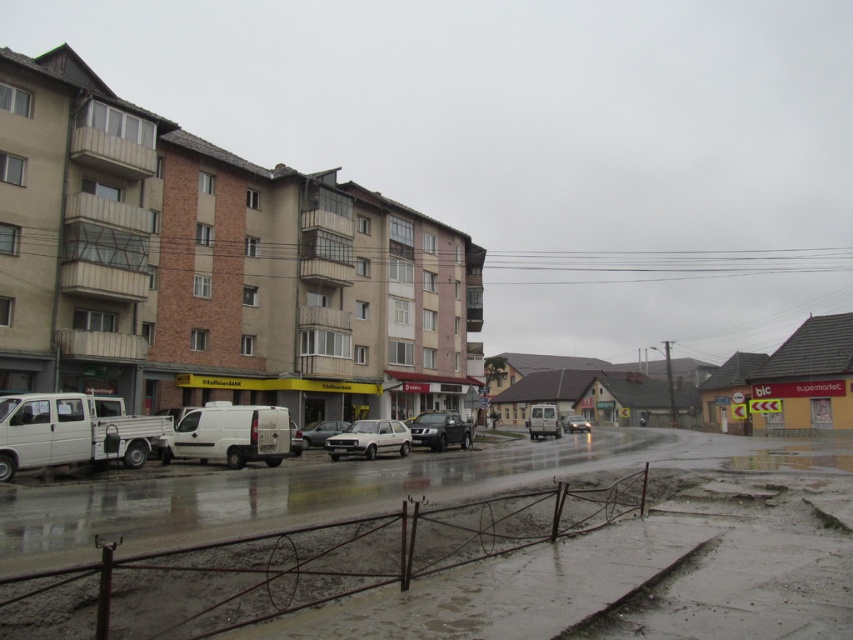
Question: Which of the following is the closest to the observer?

Choices:
 (A) (294, 422)
 (B) (358, 420)

Answer: (B)

Question: Is silver metallic car at center further to camera compared to silver metallic sedan at center?

Choices:
 (A) yes
 (B) no

Answer: (B)

Question: Does white matte van at center appear on the left side of silver metallic sedan at center?

Choices:
 (A) yes
 (B) no

Answer: (A)

Question: Estimate the real-world distances between objects in this image. Which object is farther from the matte white van at center?

Choices:
 (A) white matte van at left
 (B) silver metallic car at center
 (C) silver metallic sedan at center
 (D) white matte van at center

Answer: (A)

Question: Does matte white van at center have a smaller size compared to silver metallic car at center?

Choices:
 (A) no
 (B) yes

Answer: (A)

Question: Which is nearer to the silver metallic car at center?

Choices:
 (A) matte white van at center
 (B) satin black suv at center
 (C) white matte hatchback at center
 (D) white matte sedan at center

Answer: (D)